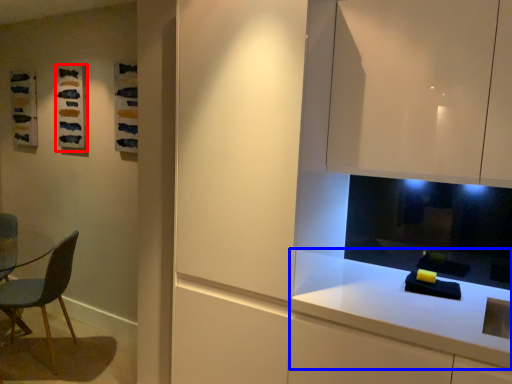
Question: Among these objects, which one is nearest to the camera, art (highlighted by a red box) or countertop (highlighted by a blue box)?

Choices:
 (A) art
 (B) countertop

Answer: (B)